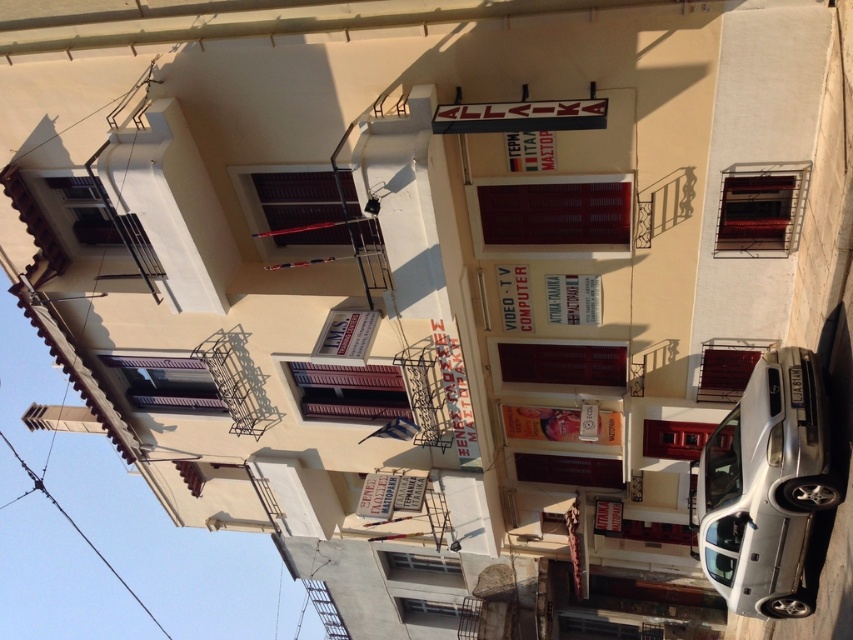
You are a delivery person trying to park your silver metallic car at lower right near the building. There is a metallic balcony at upper right above where you want to park. Is there enough vertical space between the car and the balcony to park safely?

The silver metallic car at lower right is located below the metallic balcony at upper right, so there is enough vertical space between them to park safely.

You are a delivery person trying to park your 1.8 meters tall delivery box next to the silver metallic car at lower right and the metallic red balcony at center. Which object should you place the box next to so it doesn

The silver metallic car at lower right has a greater height compared to the metallic red balcony at center. Therefore, the delivery box should be placed next to the metallic red balcony at center to ensure it doesn

You are a delivery person trying to park your silver metallic car at lower right in a parking spot that can only accommodate vehicles narrower than the metallic balcony at upper right. Can your car fit in the parking spot?

The silver metallic car at lower right is wider than the metallic balcony at upper right, so it cannot fit in the parking spot designed for narrower vehicles.